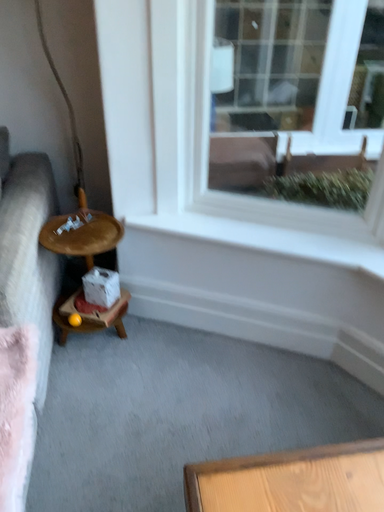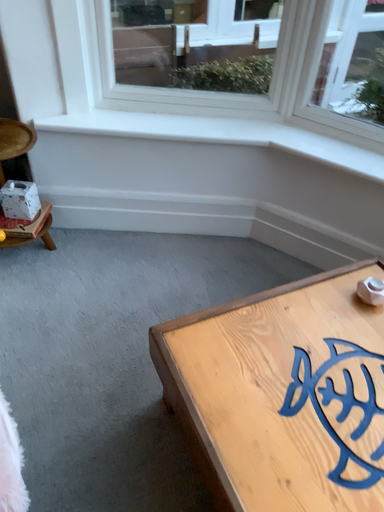
Question: Which way did the camera rotate in the video?

Choices:
 (A) rotated downward
 (B) rotated upward

Answer: (A)